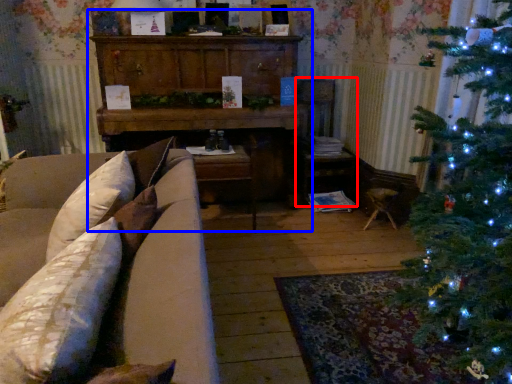
Question: Which object is closer to the camera taking this photo, armchair (highlighted by a red box) or dresser (highlighted by a blue box)?

Choices:
 (A) armchair
 (B) dresser

Answer: (B)